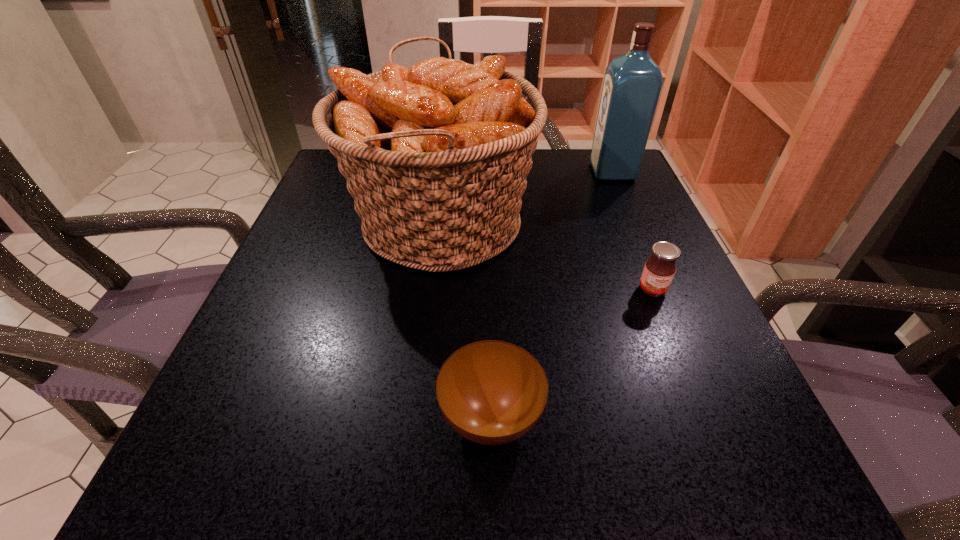
Identify the location of free region at the left edge of the desktop. Image resolution: width=960 pixels, height=540 pixels. (352, 221).

In the image, there is a desktop. Identify the location of free space at the right edge. (614, 205).

In the image, there is a desktop. Where is `vacant space at the far left corner`? vacant space at the far left corner is located at coordinates (343, 188).

You are a GUI agent. You are given a task and a screenshot of the screen. Output one action in this format:
    pyautogui.click(x=<x>, y=<y>)
    Task: Click on the vacant area at the far right corner
    This screenshot has height=540, width=960.
    Given the screenshot: What is the action you would take?
    [633, 188]

Where is `free space between the liquor and the jam`? The height and width of the screenshot is (540, 960). free space between the liquor and the jam is located at coordinates (633, 231).

Image resolution: width=960 pixels, height=540 pixels. I want to click on vacant space that's between the liquor and the basket, so click(x=526, y=198).

This screenshot has height=540, width=960. I want to click on free space between the liquor and the jam, so pos(633,231).

This screenshot has width=960, height=540. I want to click on free space between the bowl and the basket, so click(x=466, y=320).

I want to click on empty space between the jam and the basket, so click(x=546, y=256).

You are a GUI agent. You are given a task and a screenshot of the screen. Output one action in this format:
    pyautogui.click(x=<x>, y=<y>)
    Task: Click on the free area in between the jam and the liquor
    
    Given the screenshot: What is the action you would take?
    pyautogui.click(x=633, y=231)